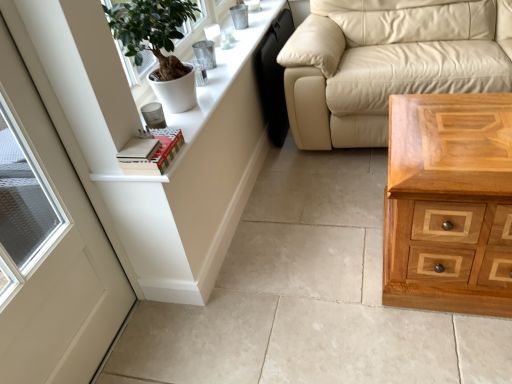
Question: From a real-world perspective, is white matte pot at upper left positioned above or below beige leather couch at upper right?

Choices:
 (A) above
 (B) below

Answer: (A)

Question: In the image, is white matte pot at upper left positioned in front of or behind beige leather couch at upper right?

Choices:
 (A) front
 (B) behind

Answer: (A)

Question: Which of these objects is positioned closest to the beige leather couch at upper right?

Choices:
 (A) light brown wood chest of drawers at lower right
 (B) white matte pot at upper left
 (C) hardcover book at upper left
 (D) white wood dresser at upper left
 (E) white matte door at left

Answer: (D)

Question: Estimate the real-world distances between objects in this image. Which object is farther from the light brown wood chest of drawers at lower right?

Choices:
 (A) beige leather couch at upper right
 (B) white matte door at left
 (C) white matte pot at upper left
 (D) white wood dresser at upper left
 (E) hardcover book at upper left

Answer: (B)